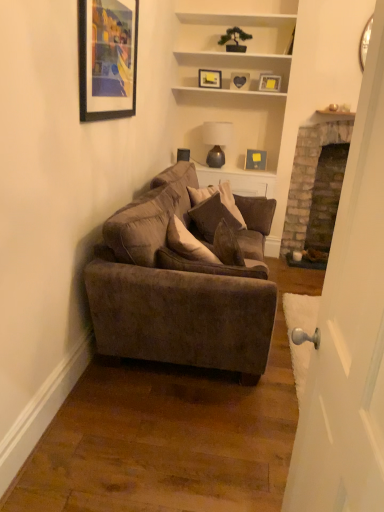
Question: Is white wood shelves at upper center facing away from matte gray lampshade at upper center?

Choices:
 (A) yes
 (B) no

Answer: (B)

Question: Can you confirm if white wood shelves at upper center is thinner than matte gray lampshade at upper center?

Choices:
 (A) no
 (B) yes

Answer: (B)

Question: Is white wood shelves at upper center further to the viewer compared to matte gray lampshade at upper center?

Choices:
 (A) no
 (B) yes

Answer: (A)

Question: Is white wood shelves at upper center to the right of matte gray lampshade at upper center from the viewer's perspective?

Choices:
 (A) yes
 (B) no

Answer: (A)

Question: Is white wood shelves at upper center not within matte gray lampshade at upper center?

Choices:
 (A) no
 (B) yes

Answer: (B)

Question: Does white wood shelves at upper center have a lesser height compared to matte gray lampshade at upper center?

Choices:
 (A) no
 (B) yes

Answer: (A)

Question: Is white wood shelves at upper center in contact with matte black picture frame at upper center, positioned as the 1th picture frame in back-to-front order?

Choices:
 (A) yes
 (B) no

Answer: (B)

Question: Is white wood shelves at upper center taller than matte black picture frame at upper center, acting as the second picture frame starting from the right?

Choices:
 (A) no
 (B) yes

Answer: (B)

Question: Does white wood shelves at upper center have a larger size compared to matte black picture frame at upper center, which ranks as the 5th picture frame in front-to-back order?

Choices:
 (A) yes
 (B) no

Answer: (A)

Question: Is white wood shelves at upper center outside of matte black picture frame at upper center, which ranks as the 5th picture frame in front-to-back order?

Choices:
 (A) no
 (B) yes

Answer: (B)

Question: Is white wood shelves at upper center at the right side of matte black picture frame at upper center, positioned as the 1th picture frame in back-to-front order?

Choices:
 (A) yes
 (B) no

Answer: (B)

Question: Considering the relative sizes of white wood shelves at upper center and matte black picture frame at upper center, acting as the second picture frame starting from the right, in the image provided, is white wood shelves at upper center smaller than matte black picture frame at upper center, acting as the second picture frame starting from the right,?

Choices:
 (A) yes
 (B) no

Answer: (B)

Question: From a real-world perspective, is matte gray lampshade at upper center positioned under brick fireplace at right based on gravity?

Choices:
 (A) no
 (B) yes

Answer: (A)